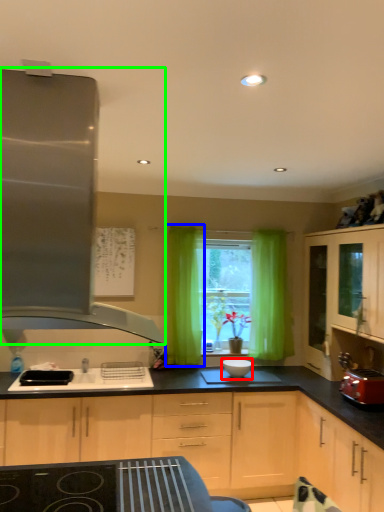
Question: Based on their relative distances, which object is nearer to appliance (highlighted by a red box)? Choose from curtain (highlighted by a blue box) and kitchen appliance (highlighted by a green box).

Choices:
 (A) curtain
 (B) kitchen appliance

Answer: (A)